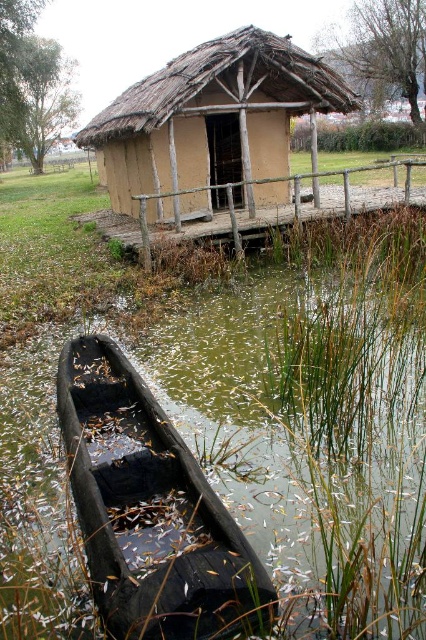
In the scene shown: Who is more forward, (51, 336) or (106, 580)?

Point (106, 580)

Is green mossy water at bottom left wider than dark brown wooden boat at lower left?

Incorrect, green mossy water at bottom left's width does not surpass dark brown wooden boat at lower left's.

Where is `green mossy water at bottom left`? Image resolution: width=426 pixels, height=640 pixels. green mossy water at bottom left is located at coordinates (302, 433).

Does green mossy water at bottom left appear under brown clay hut at center?

Yes, green mossy water at bottom left is below brown clay hut at center.

Does green mossy water at bottom left have a greater width compared to brown clay hut at center?

In fact, green mossy water at bottom left might be narrower than brown clay hut at center.

Is point (17, 538) closer to camera compared to point (215, 125)?

Yes.

At what (x,y) coordinates should I click in order to perform the action: click on green mossy water at bottom left. Please return your answer as a coordinate pair (x, y). This screenshot has height=640, width=426. Looking at the image, I should click on (302, 433).

Between dark brown wooden boat at lower left and brown clay hut at center, which one appears on the right side from the viewer's perspective?

dark brown wooden boat at lower left

Between dark brown wooden boat at lower left and brown clay hut at center, which one has more height?

brown clay hut at center

Who is more distant from viewer, [118,458] or [259,99]?

The point [259,99] is more distant.

I want to click on dark brown wooden boat at lower left, so click(149, 509).